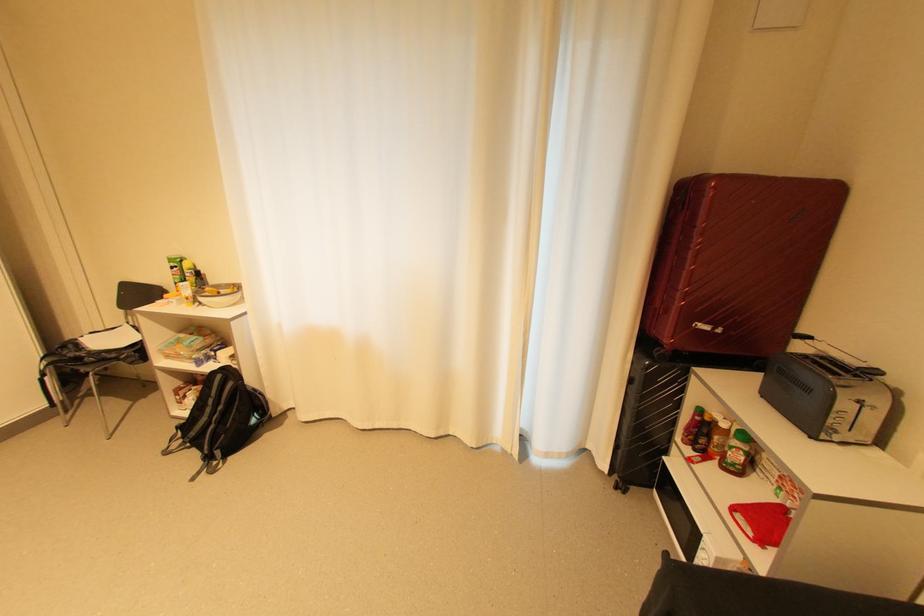
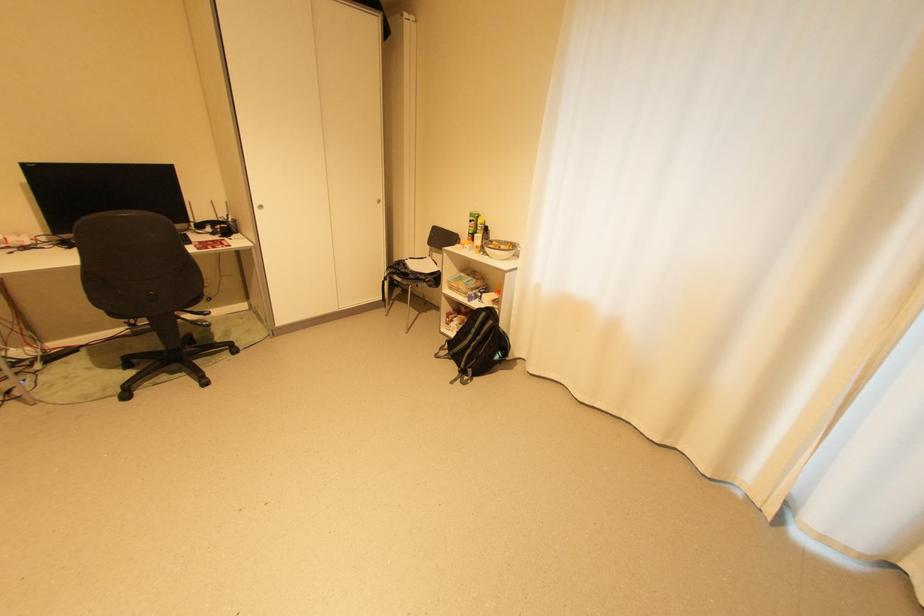
Question: The camera is either moving clockwise (left) or counter-clockwise (right) around the object. The first image is from the beginning of the video and the second image is from the end. Is the camera moving left or right when shooting the video?

Choices:
 (A) Left
 (B) Right

Answer: (B)